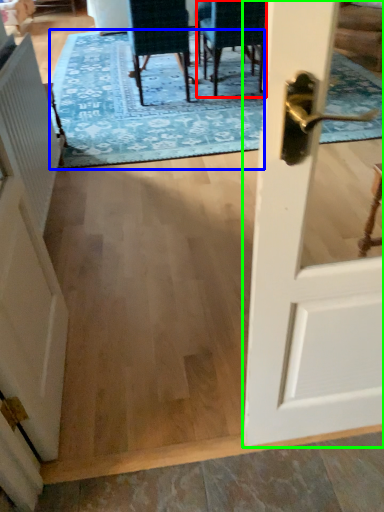
Question: Considering the real-world distances, which object is farthest from chair (highlighted by a red box)? mat (highlighted by a blue box) or door (highlighted by a green box)?

Choices:
 (A) mat
 (B) door

Answer: (B)